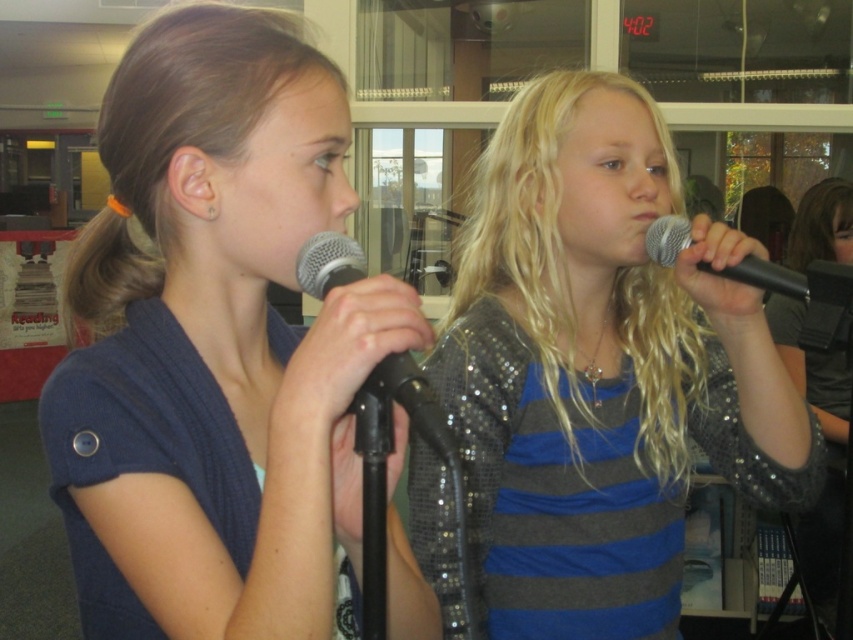
You are a photographer positioned in front of the stage. You need to focus your camera on the shiny sequined top at center and the silver metallic microphone at right. Which object should you adjust your focus to first to ensure it appears sharp?

The shiny sequined top at center is closer to the viewer than the silver metallic microphone at right, so you should focus on the shiny sequined top at center first to ensure it is sharp before adjusting for the microphone.

You are a photographer trying to capture the shiny sequined top at center. The camera is set to focus on the point at coordinates point [601,371]. Will the shiny sequined top at center be in focus?

The shiny sequined top at center is located at point [601,371], so yes, the camera will focus on the shiny sequined top at center.

You are a photographer setting up for a photoshoot. You need to position a light source between the shiny sequined top at center and the shiny sequined dress at right. What is the minimum distance the light should be placed from each object to ensure it is equidistant from both?

The minimum distance the light should be placed from each object is 0.655 meters. Since the two objects are 1.31 meters apart, placing the light exactly halfway between them ensures equal distance from both. Half of 1.31 meters is 0.655 meters, so positioning the light at this midpoint will achieve the desired equidistant placement.